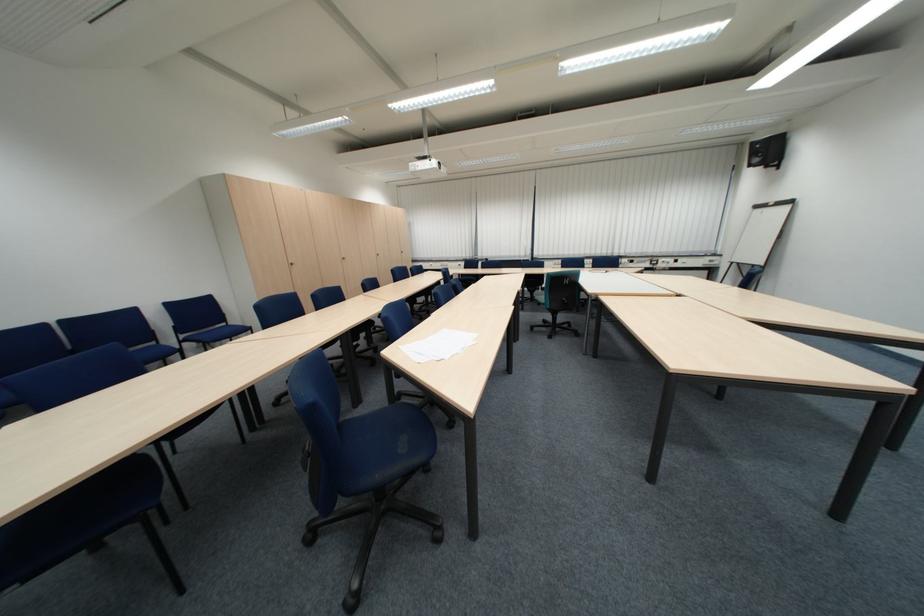
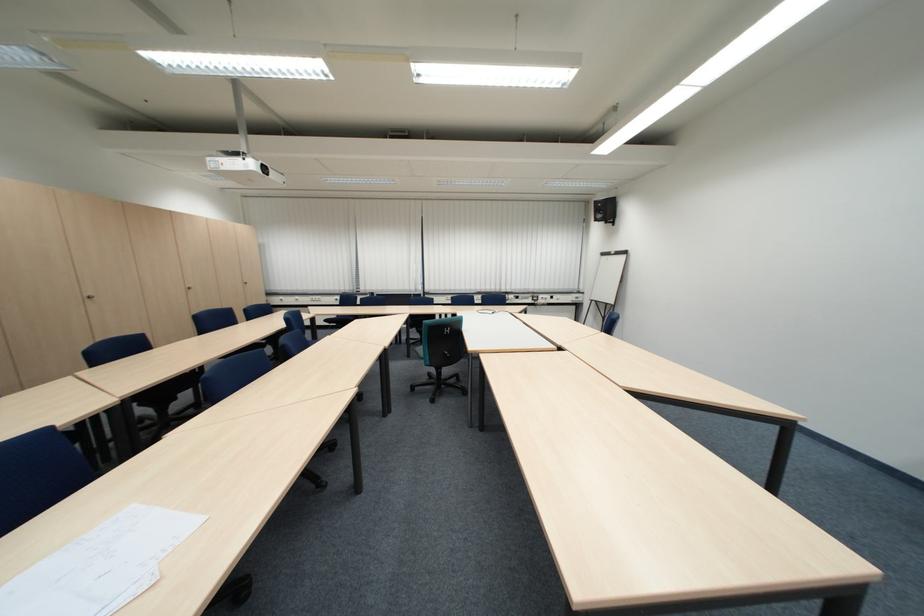
Question: The camera is either moving clockwise (left) or counter-clockwise (right) around the object. The first image is from the beginning of the video and the second image is from the end. Is the camera moving left or right when shooting the video?

Choices:
 (A) Left
 (B) Right

Answer: (A)